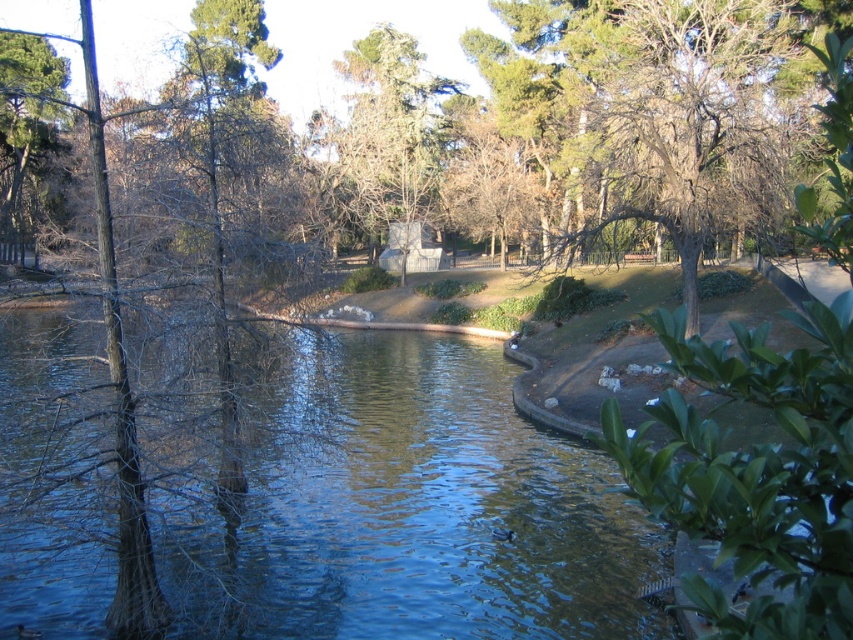
In the scene shown: You are planning to take a photo of the blue water at center and the green leafy tree at center from the grassy area on the right. Which object should you focus on first to ensure both are in the frame?

The blue water at center is wider than the green leafy tree at center, so you should focus on the blue water at center first to ensure both are in the frame.

You are a park visitor standing on the paved pathway. You want to take a photo of the blue water at center and the green matte tree at upper left. Which object should you point your camera towards first if you want to capture both in the same frame?

You should point your camera towards the green matte tree at upper left first because the blue water at center is below it, ensuring both can be captured in the same frame when framing from the top down.